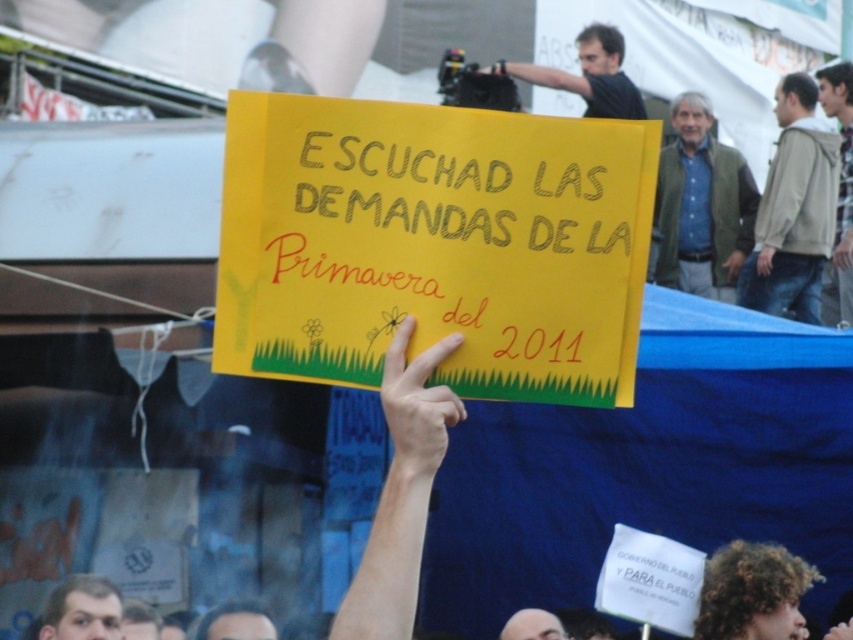
Can you confirm if green textured jacket at upper right is thinner than dark blue shirt at upper center?

Yes, green textured jacket at upper right is thinner than dark blue shirt at upper center.

Is green textured jacket at upper right behind dark blue shirt at upper center?

No, green textured jacket at upper right is closer to the viewer.

Which is in front, point (701, 252) or point (613, 88)?

Point (701, 252) is more forward.

Where is `green textured jacket at upper right`? The width and height of the screenshot is (853, 640). green textured jacket at upper right is located at coordinates (701, 205).

Who is more forward, [659,211] or [102,630]?

Positioned in front is point [102,630].

Which is below, green textured jacket at upper right or smooth skin face at lower left?

Positioned lower is smooth skin face at lower left.

Who is more distant from viewer, (677, 195) or (74, 611)?

Point (677, 195)

Where is `green textured jacket at upper right`? green textured jacket at upper right is located at coordinates (701, 205).

From the picture: How far apart are skinny yellow sign at center and dark brown hair at center?

skinny yellow sign at center and dark brown hair at center are 6.25 meters apart.

Is point (387, 390) in front of point (229, 632)?

Yes, point (387, 390) is in front of point (229, 632).

Identify the location of skinny yellow sign at center. The height and width of the screenshot is (640, 853). (416, 406).